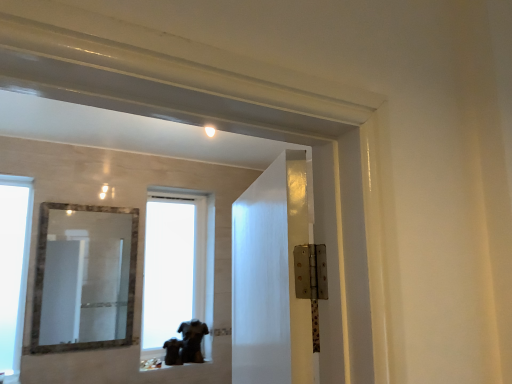
Question: Does transparent glass window at left, which appears as the first window when viewed from the front, come in front of marble-framed mirror at center?

Choices:
 (A) no
 (B) yes

Answer: (A)

Question: Can you confirm if transparent glass window at left, placed as the 1th window when sorted from left to right, is shorter than marble-framed mirror at center?

Choices:
 (A) yes
 (B) no

Answer: (B)

Question: Is transparent glass window at left, placed as the 1th window when sorted from left to right, far away from marble-framed mirror at center?

Choices:
 (A) no
 (B) yes

Answer: (B)

Question: Would you say transparent glass window at left, which appears as the first window when viewed from the front, contains marble-framed mirror at center?

Choices:
 (A) no
 (B) yes

Answer: (A)

Question: From a real-world perspective, is transparent glass window at left, placed as the second window when sorted from right to left, on top of marble-framed mirror at center?

Choices:
 (A) yes
 (B) no

Answer: (B)

Question: From a real-world perspective, is transparent glass window at left, which appears as the first window when viewed from the front, physically below marble-framed mirror at center?

Choices:
 (A) yes
 (B) no

Answer: (A)

Question: Can you confirm if transparent glass window at center, the 1th window when ordered from back to front, is positioned to the right of marble-framed mirror at center?

Choices:
 (A) yes
 (B) no

Answer: (A)

Question: Does transparent glass window at center, the 1th window when ordered from back to front, have a lesser height compared to marble-framed mirror at center?

Choices:
 (A) no
 (B) yes

Answer: (A)

Question: Would you consider transparent glass window at center, placed as the 2th window when sorted from left to right, to be distant from marble-framed mirror at center?

Choices:
 (A) yes
 (B) no

Answer: (B)

Question: Can you confirm if transparent glass window at center, placed as the 2th window when sorted from left to right, is thinner than marble-framed mirror at center?

Choices:
 (A) no
 (B) yes

Answer: (A)

Question: Is transparent glass window at center, the 1th window when ordered from back to front, to the left of marble-framed mirror at center from the viewer's perspective?

Choices:
 (A) yes
 (B) no

Answer: (B)

Question: Could you tell me if transparent glass window at center, the 1th window when ordered from back to front, is facing marble-framed mirror at center?

Choices:
 (A) yes
 (B) no

Answer: (B)

Question: Can you confirm if transparent glass window at center, placed as the 2th window when sorted from left to right, is bigger than transparent glass window at left, acting as the 2th window starting from the back?

Choices:
 (A) yes
 (B) no

Answer: (A)